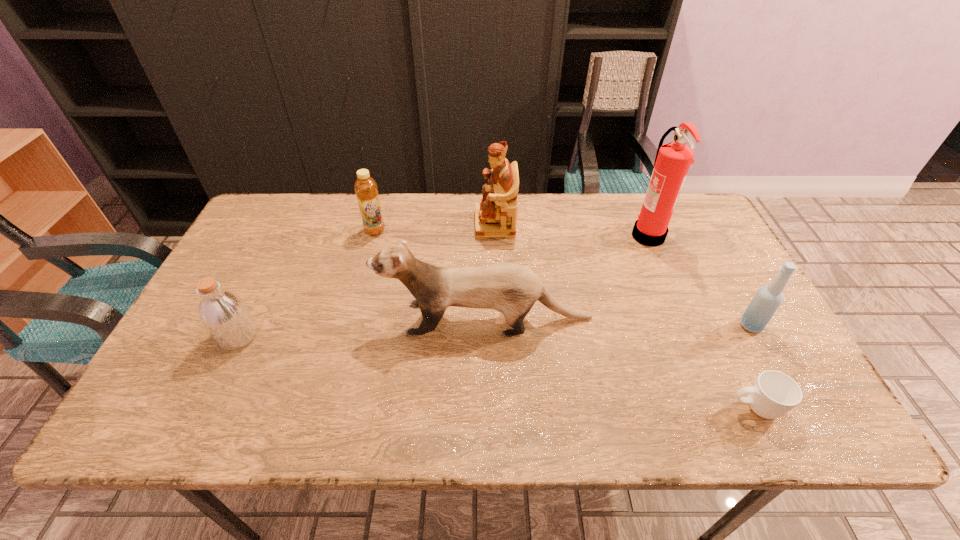
Image resolution: width=960 pixels, height=540 pixels. In order to click on the tallest object in this screenshot , I will do `click(673, 160)`.

Locate an element on the screen. figurine is located at coordinates (496, 214).

The height and width of the screenshot is (540, 960). I want to click on ferret, so click(512, 289).

You are a GUI agent. You are given a task and a screenshot of the screen. Output one action in this format:
    pyautogui.click(x=<x>, y=<y>)
    Task: Click on the sixth object from right to left
    
    Given the screenshot: What is the action you would take?
    coord(365,187)

Image resolution: width=960 pixels, height=540 pixels. What are the coordinates of `the second bottle from right to left` in the screenshot? It's located at pos(365,187).

Identify the location of the rightmost bottle. The image size is (960, 540). (767, 300).

This screenshot has height=540, width=960. I want to click on the leftmost object, so click(223, 314).

Where is `the shortest object`? The image size is (960, 540). the shortest object is located at coordinates (773, 394).

Locate an element on the screen. cup is located at coordinates (773, 394).

I want to click on free location located 0.370m with the nozzle aimed from the fire extinguisher, so click(x=511, y=235).